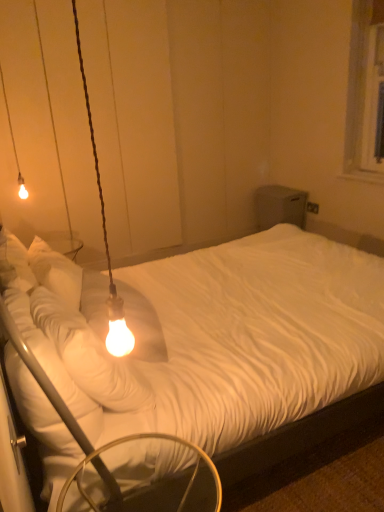
Question: Is matte glass bulb at left, which is the 1th lamp in right-to-left order, taller or shorter than metallic silver swivel chair at lower left?

Choices:
 (A) short
 (B) tall

Answer: (B)

Question: From a real-world perspective, is matte glass bulb at left, the first lamp positioned from the bottom, physically located above or below metallic silver swivel chair at lower left?

Choices:
 (A) above
 (B) below

Answer: (A)

Question: Which of these objects is positioned farthest from the white textured bed at center?

Choices:
 (A) metallic silver swivel chair at lower left
 (B) matte glass bulb at upper left, which appears as the first lamp when viewed from the left
 (C) matte glass bulb at left, which is the 1th lamp in right-to-left order

Answer: (B)

Question: Which is nearer to the metallic silver swivel chair at lower left?

Choices:
 (A) matte glass bulb at upper left, marked as the second lamp in a right-to-left arrangement
 (B) white textured bed at center
 (C) matte glass bulb at left, which is the 1th lamp in right-to-left order

Answer: (C)